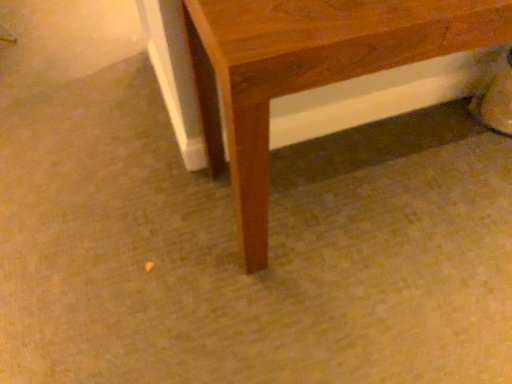
Based on the photo, what is the approximate height of wooden table at lower right?

The height of wooden table at lower right is 31.21 inches.

Consider the image. What is the approximate width of wooden table at lower right?

49.23 centimeters.

Measure the distance between wooden table at lower right and camera.

wooden table at lower right and camera are 26.95 inches apart from each other.

Where is `wooden table at lower right`? wooden table at lower right is located at coordinates (307, 69).

The image size is (512, 384). What do you see at coordinates (307, 69) in the screenshot?
I see `wooden table at lower right` at bounding box center [307, 69].

This screenshot has height=384, width=512. In order to click on wooden table at lower right in this screenshot , I will do `click(307, 69)`.